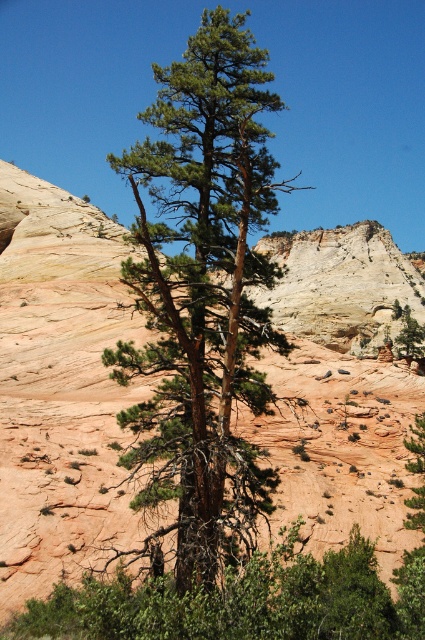
You are standing in front of the tall pine tree and looking at the rugged terrain around it. There are two points marked on the ground at coordinates point (135, 388) and point (187, 584). Which point is closer to you?

Point (135, 388) is further to the camera than point (187, 584), so the point closer to you is point (187, 584).